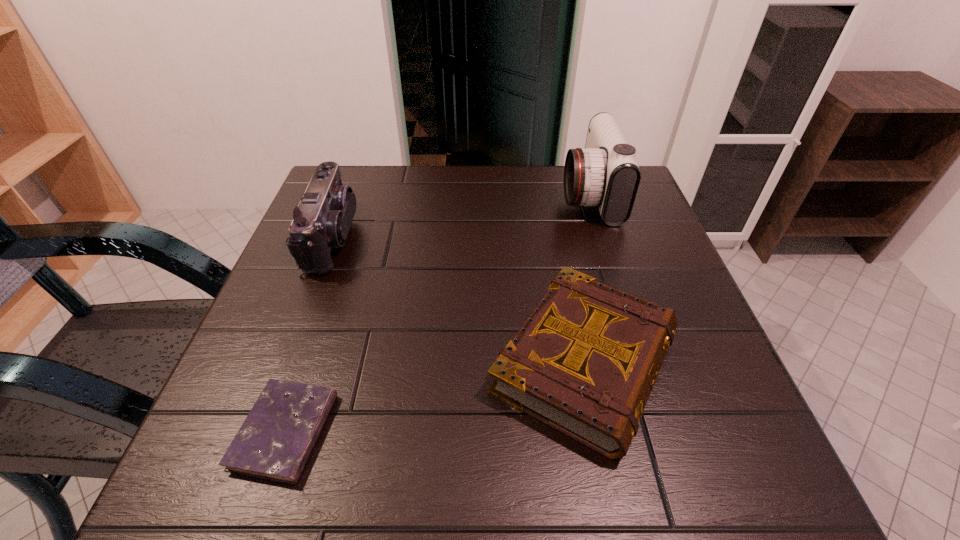
The width and height of the screenshot is (960, 540). In order to click on the taller camcorder in this screenshot , I will do `click(605, 174)`.

Identify the location of the right camcorder. The width and height of the screenshot is (960, 540). (605, 174).

Identify the location of the shorter camcorder. This screenshot has width=960, height=540. (322, 220).

Find the location of a particular element. The height and width of the screenshot is (540, 960). the left camcorder is located at coordinates (322, 220).

Locate an element on the screen. This screenshot has width=960, height=540. hardback book is located at coordinates (585, 361).

This screenshot has width=960, height=540. Find the location of `the shortest object`. the shortest object is located at coordinates (274, 442).

You are a GUI agent. You are given a task and a screenshot of the screen. Output one action in this format:
    pyautogui.click(x=<x>, y=<y>)
    Task: Click on the vacant space located on the surface of the taller camcorder
    The height and width of the screenshot is (540, 960).
    Given the screenshot: What is the action you would take?
    pyautogui.click(x=527, y=195)

The height and width of the screenshot is (540, 960). Identify the location of free region located on the surface of the taller camcorder. pos(450,195).

Identify the location of free space located on the surface of the taller camcorder. The image size is (960, 540). (539, 195).

Locate an element on the screen. vacant position located on the front-facing side of the left camcorder is located at coordinates (410, 237).